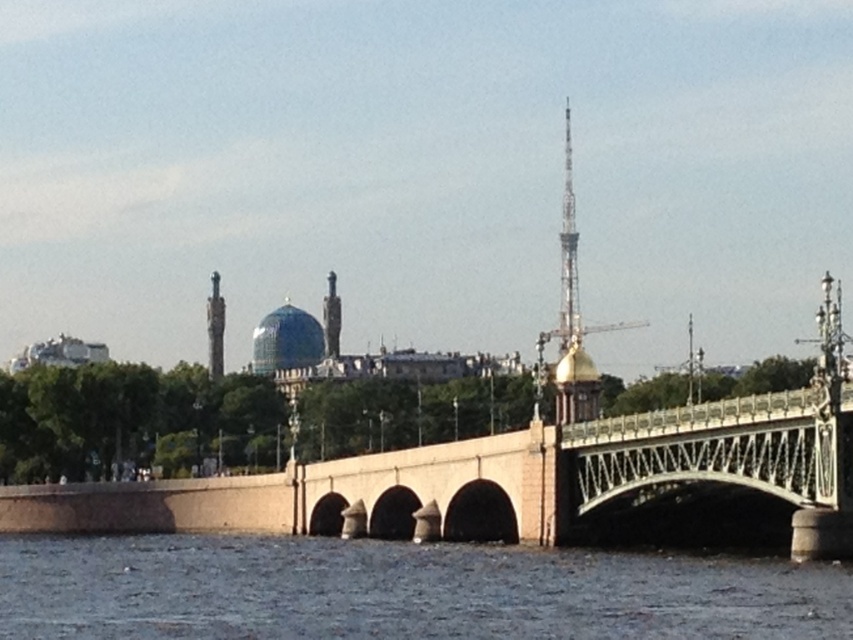
The height and width of the screenshot is (640, 853). Describe the element at coordinates (401, 592) in the screenshot. I see `gray concrete river at lower center` at that location.

Is point (39, 552) closer to viewer compared to point (334, 337)?

Yes.

At what (x,y) coordinates should I click in order to perform the action: click on gray concrete river at lower center. Please return your answer as a coordinate pair (x, y). Looking at the image, I should click on (401, 592).

Does point (357, 458) lie behind point (213, 317)?

No, it is in front of (213, 317).

Does stone bridge at center appear over polished bronze statue at left?

Incorrect, stone bridge at center is not positioned above polished bronze statue at left.

Between point (404, 483) and point (218, 342), which one is positioned behind?

The point (218, 342) is behind.

Locate an element on the screen. The height and width of the screenshot is (640, 853). stone bridge at center is located at coordinates (509, 481).

Is stone bridge at center taller than blue dome at center?

Indeed, stone bridge at center has a greater height compared to blue dome at center.

Locate an element on the screen. This screenshot has height=640, width=853. stone bridge at center is located at coordinates (509, 481).

Measure the distance between point (488, 468) and camera.

Point (488, 468) and camera are 112.70 meters apart.

What are the coordinates of `stone bridge at center` in the screenshot? It's located at (509, 481).